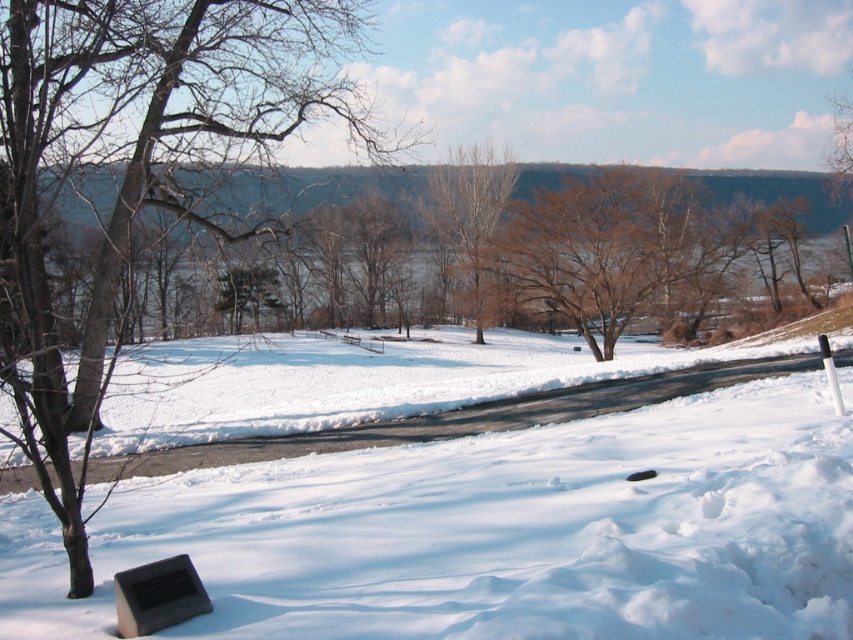
Question: Which object appears closest to the camera in this image?

Choices:
 (A) brown/dry wood tree at lower left
 (B) white fluffy snow at center

Answer: (B)

Question: Among these objects, which one is nearest to the camera?

Choices:
 (A) white fluffy snow at center
 (B) brown matte tree at center

Answer: (A)

Question: Is white fluffy snow at center closer to camera compared to brown matte tree at center?

Choices:
 (A) no
 (B) yes

Answer: (B)

Question: Estimate the real-world distances between objects in this image. Which object is closer to the brown/dry wood tree at lower left?

Choices:
 (A) brown matte tree at center
 (B) black polished stone plaque at lower left

Answer: (B)

Question: Does brown/dry wood tree at lower left have a larger size compared to black polished stone plaque at lower left?

Choices:
 (A) yes
 (B) no

Answer: (A)

Question: Does white fluffy snow at center have a greater width compared to brown/dry wood tree at lower left?

Choices:
 (A) no
 (B) yes

Answer: (B)